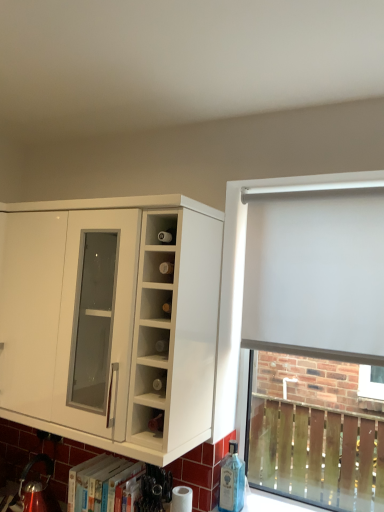
Question: From the image's perspective, relative to white matte roller blind at right, is white glossy cabinet at left above or below?

Choices:
 (A) above
 (B) below

Answer: (A)

Question: Based on their sizes in the image, would you say white glossy cabinet at left is bigger or smaller than white matte roller blind at right?

Choices:
 (A) big
 (B) small

Answer: (A)

Question: Which object is positioned closest to the white glossy cabinet at left?

Choices:
 (A) white fabric curtain at right
 (B) white matte roller blind at right

Answer: (A)

Question: Estimate the real-world distances between objects in this image. Which object is farther from the white matte roller blind at right?

Choices:
 (A) white glossy cabinet at left
 (B) white fabric curtain at right

Answer: (A)